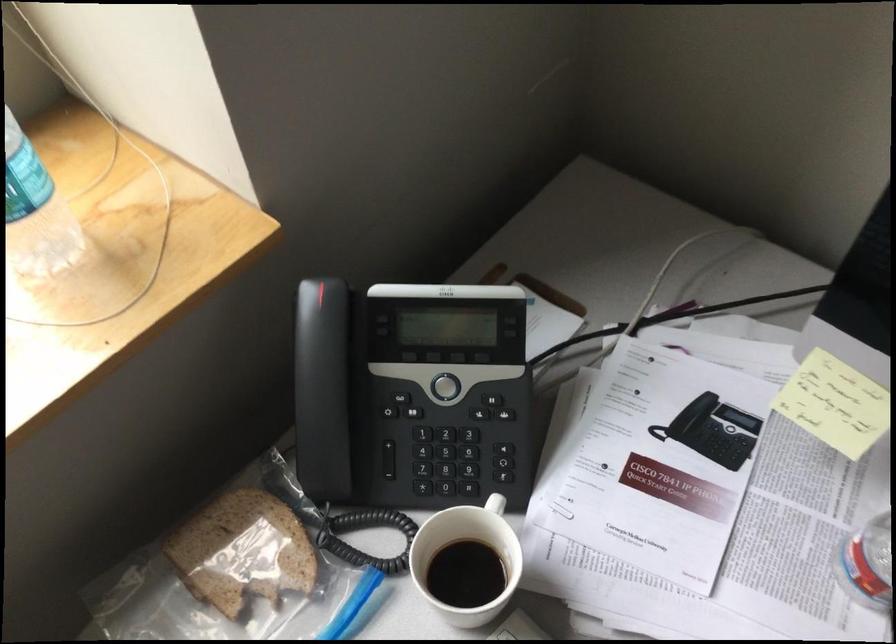
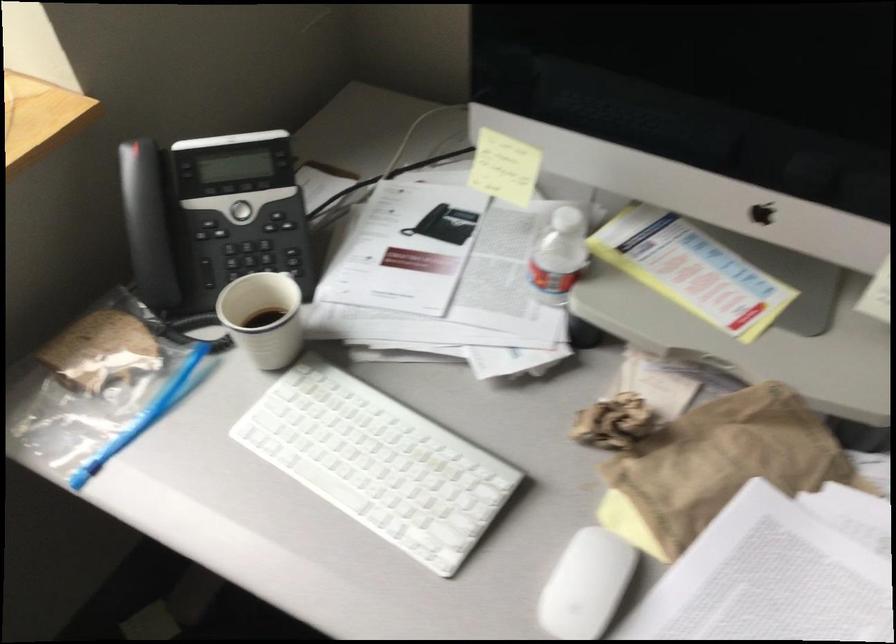
The point at (323, 371) is marked in the first image. Where is the corresponding point in the second image?

(142, 203)